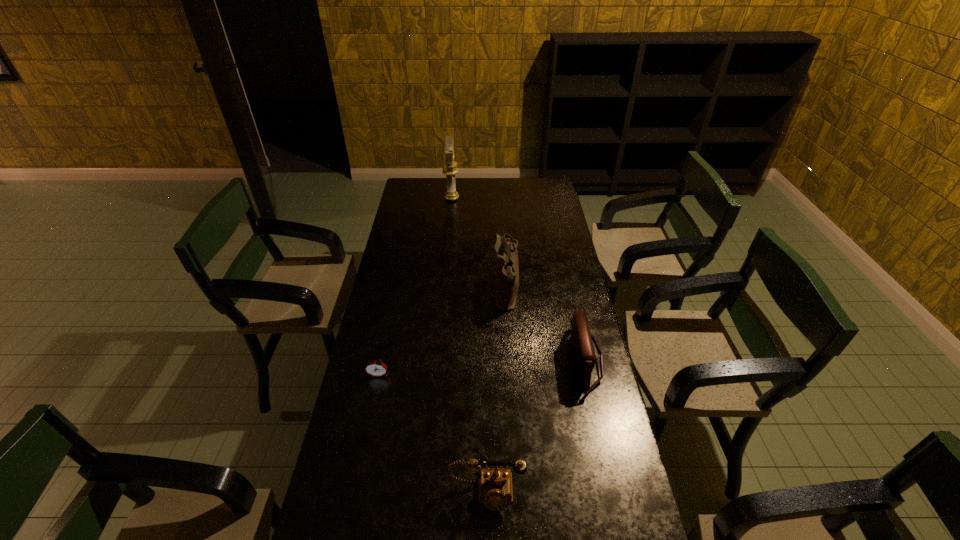
Where is `free space between the right shoulder bag and the telephone`? This screenshot has width=960, height=540. free space between the right shoulder bag and the telephone is located at coordinates (536, 427).

The image size is (960, 540). Identify the location of object that ranks as the fourth closest to the fourth nearest object. (495, 490).

This screenshot has width=960, height=540. I want to click on object that stands as the third closest to the farther shoulder bag, so (450, 169).

This screenshot has height=540, width=960. In order to click on free space that satisfies the following two spatial constraints: 1. on the front flap of the nearer shoulder bag; 2. on the dial number of the nearest object in this screenshot , I will do `click(615, 492)`.

Where is `free space that satisfies the following two spatial constraints: 1. on the front-facing side of the left shoulder bag; 2. on the clock face of the alarm clock`? The image size is (960, 540). free space that satisfies the following two spatial constraints: 1. on the front-facing side of the left shoulder bag; 2. on the clock face of the alarm clock is located at coordinates (511, 375).